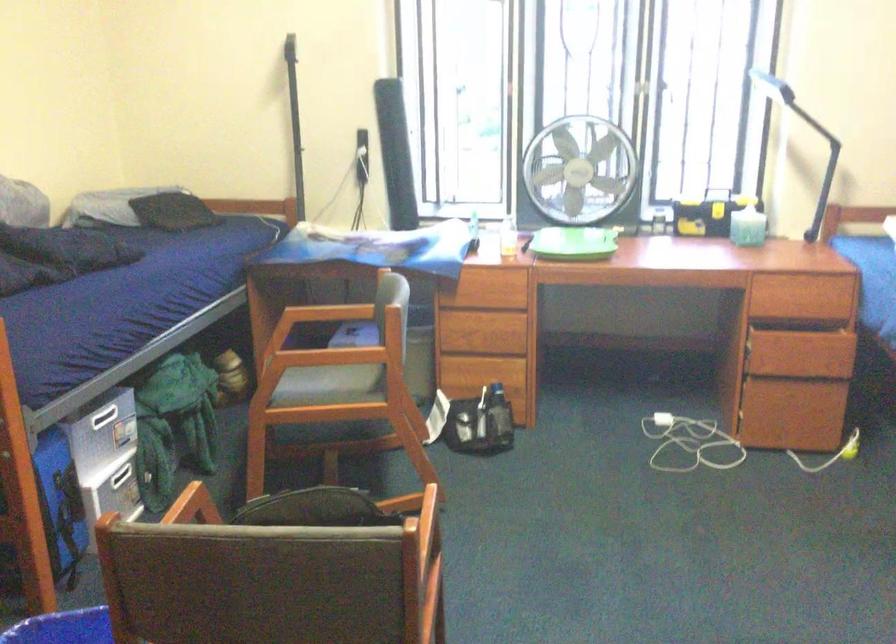
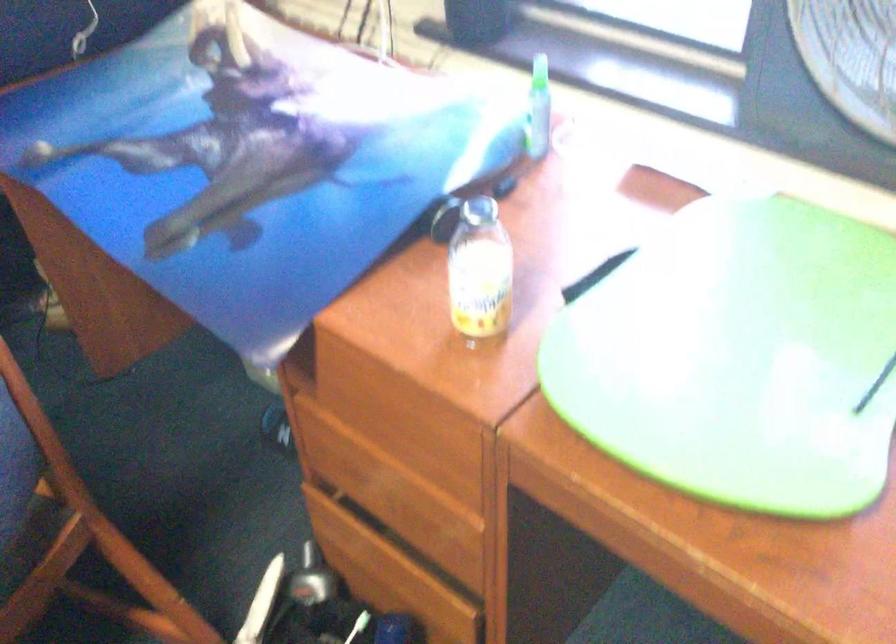
In the second image, find the point that corresponds to pixel 494 319 in the first image.

(408, 485)